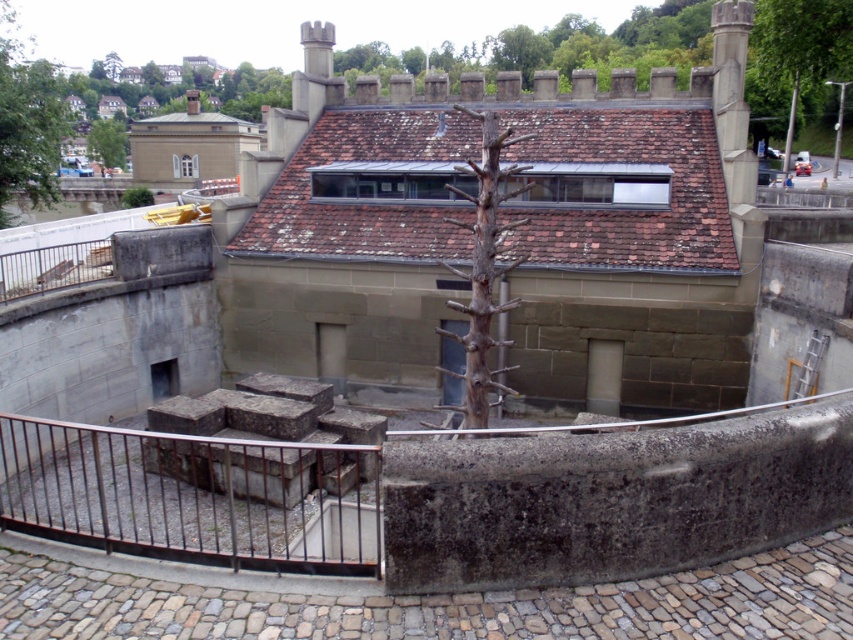
You are standing in front of the historic building and want to take a photo that includes both the point at coordinates (479, 344) and the point at (1, 84). Which point should you focus on first to ensure both are in the frame?

You should focus on point (479, 344) first because it is closer to you than point (1, 84), ensuring both points remain in the frame.

You are a visitor at this historic site and want to take a photo of the green leafy tree at upper left without the rusty metal railing at lower left in the frame. Which direction should you move to ensure the tree is visible but the railing is not?

Move to the left side so that the green leafy tree at upper left is framed without the rusty metal railing at lower left, since the railing is positioned to the right of the tree.